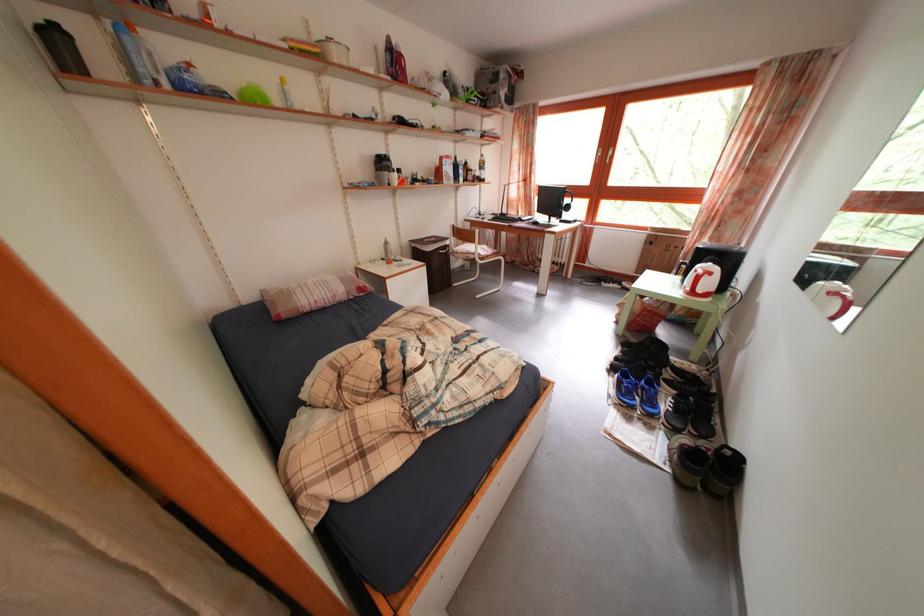
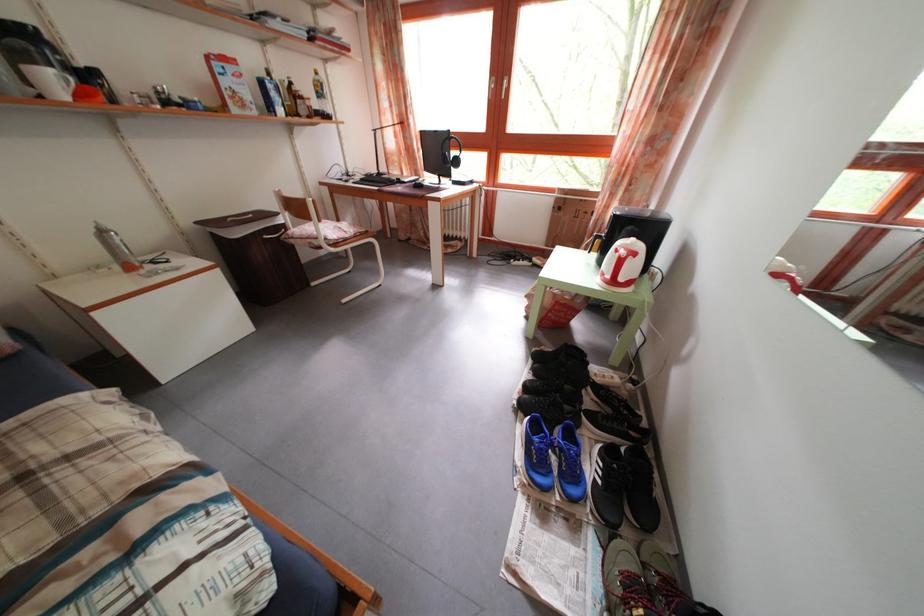
In the second image, find the point that corresponds to the point at 718,281 in the first image.

(641, 262)